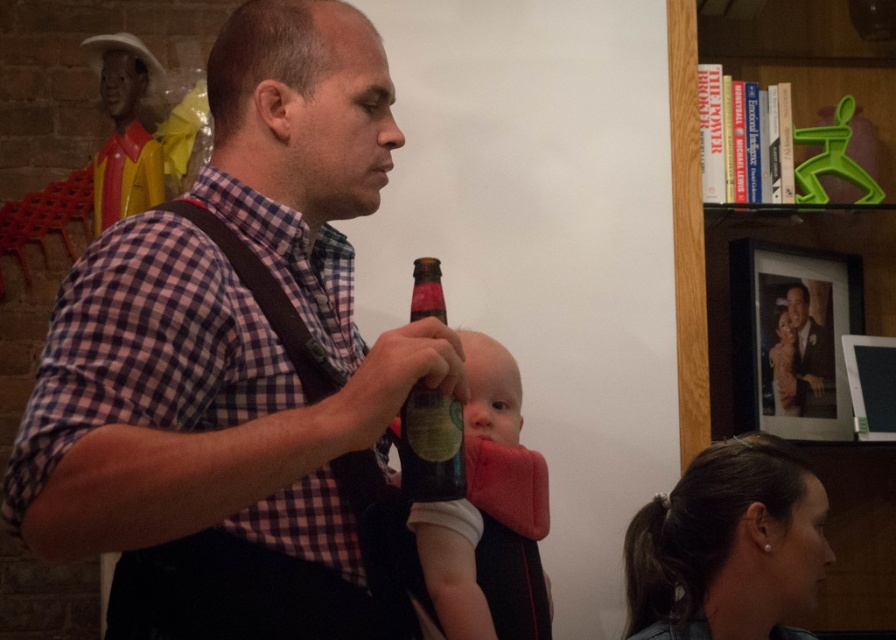
How far apart are smooth plastic bottle at center and formal suit at upper right?

The distance of smooth plastic bottle at center from formal suit at upper right is 1.15 meters.

Looking at this image, between smooth plastic bottle at center and formal suit at upper right, which one is positioned higher?

Positioned higher is formal suit at upper right.

This screenshot has width=896, height=640. Describe the element at coordinates (451, 568) in the screenshot. I see `smooth plastic bottle at center` at that location.

You are a GUI agent. You are given a task and a screenshot of the screen. Output one action in this format:
    pyautogui.click(x=<x>, y=<y>)
    Task: Click on the smooth plastic bottle at center
    
    Given the screenshot: What is the action you would take?
    pyautogui.click(x=451, y=568)

Is green plastic figure at upper right smaller than smooth plastic bottle at center?

No, green plastic figure at upper right is not smaller than smooth plastic bottle at center.

Can you confirm if green plastic figure at upper right is wider than smooth plastic bottle at center?

Yes, green plastic figure at upper right is wider than smooth plastic bottle at center.

Is point (743, 56) positioned in front of point (419, 557)?

No, (743, 56) is behind (419, 557).

This screenshot has width=896, height=640. What are the coordinates of `green plastic figure at upper right` in the screenshot? It's located at (765, 211).

Describe the element at coordinates (377, 534) in the screenshot. I see `brown leather suspenders at left` at that location.

Is brown leather suspenders at left thinner than formal suit at upper right?

Incorrect, brown leather suspenders at left's width is not less than formal suit at upper right's.

Does point (362, 483) come behind point (812, 388)?

No, it is not.

In order to click on brown leather suspenders at left in this screenshot , I will do `click(377, 534)`.